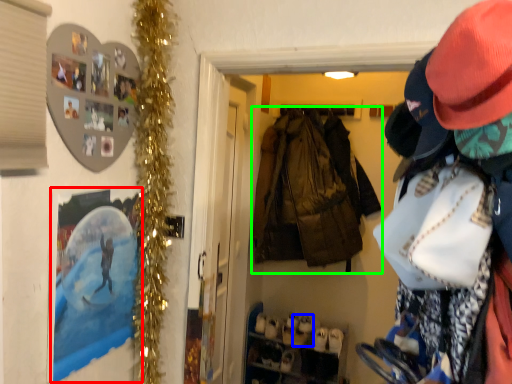
Question: Which object is positioned farthest from picture frame (highlighted by a red box)? Select from shoe (highlighted by a blue box) and jacket (highlighted by a green box).

Choices:
 (A) shoe
 (B) jacket

Answer: (A)